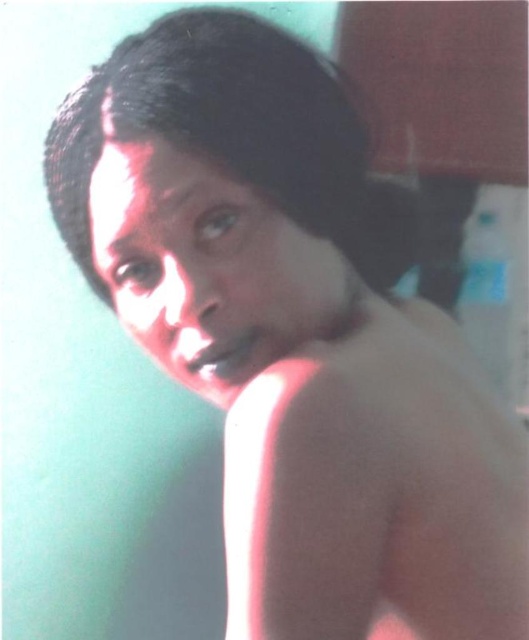
Based on the scene description, which object is taller between the smooth skin at right and the black matte hair at center?

The smooth skin at right is much taller than the black matte hair at center.

Based on the scene description, where is the smooth skin at right in relation to the black matte hair at center?

The smooth skin at right is located below the black matte hair at center.